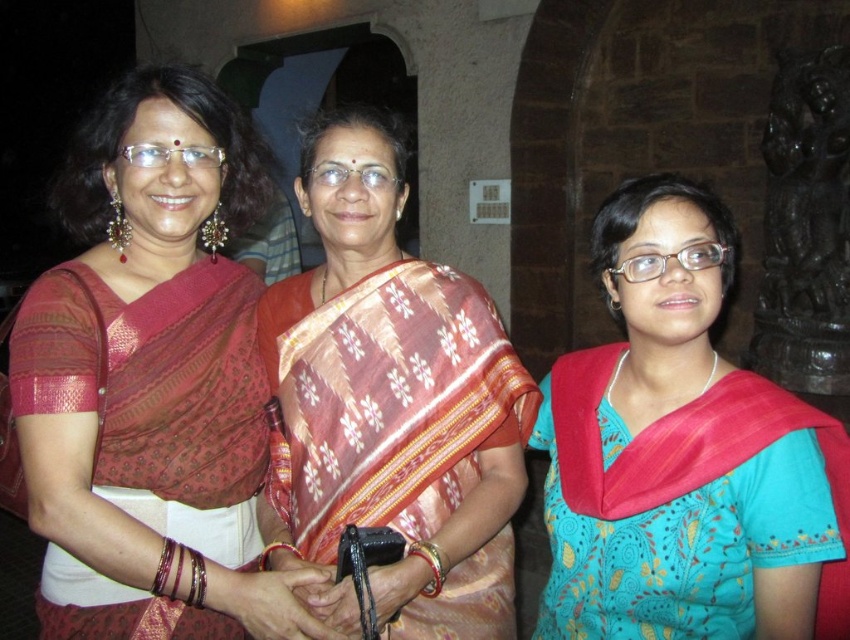
Is matte silk saree at center to the right of silk saree at center from the viewer's perspective?

No, matte silk saree at center is not to the right of silk saree at center.

Can you confirm if matte silk saree at center is bigger than silk saree at center?

Indeed, matte silk saree at center has a larger size compared to silk saree at center.

This screenshot has height=640, width=850. What are the coordinates of `matte silk saree at center` in the screenshot? It's located at (153, 380).

This screenshot has height=640, width=850. In order to click on matte silk saree at center in this screenshot , I will do `click(153, 380)`.

Does teal silk blouse at center appear over silk saree at center?

No, teal silk blouse at center is not above silk saree at center.

Is point (658, 278) closer to viewer compared to point (502, 506)?

That is True.

You are a GUI agent. You are given a task and a screenshot of the screen. Output one action in this format:
    pyautogui.click(x=<x>, y=<y>)
    Task: Click on the teal silk blouse at center
    
    Given the screenshot: What is the action you would take?
    pyautogui.click(x=684, y=454)

Is matte silk saree at center positioned behind teal silk blouse at center?

Yes, it is.

Can you confirm if matte silk saree at center is thinner than teal silk blouse at center?

Incorrect, matte silk saree at center's width is not less than teal silk blouse at center's.

Is point (191, 92) positioned before point (795, 476)?

No, it is not.

Find the location of a particular element. Image resolution: width=850 pixels, height=640 pixels. matte silk saree at center is located at coordinates (153, 380).